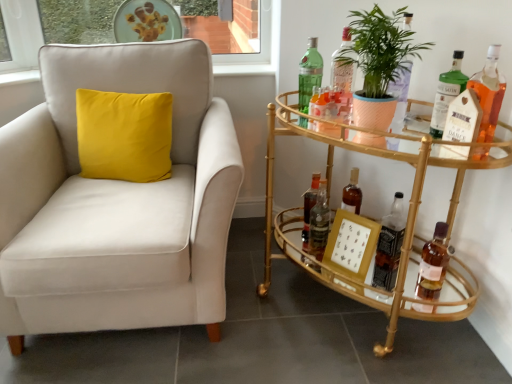
Question: Is the depth of green glass bottle at upper right, which appears as the 5th bottle when viewed from the right, greater than that of translucent glass bottle at right, which appears as the eighth bottle when viewed from the left?

Choices:
 (A) no
 (B) yes

Answer: (B)

Question: Is green glass bottle at upper right, which appears as the 5th bottle when viewed from the right, shorter than translucent glass bottle at right, which appears as the eighth bottle when viewed from the left?

Choices:
 (A) no
 (B) yes

Answer: (A)

Question: Could you tell me if green glass bottle at upper right, which appears as the 5th bottle when viewed from the right, is turned towards translucent glass bottle at right, which appears as the eighth bottle when viewed from the left?

Choices:
 (A) no
 (B) yes

Answer: (A)

Question: Does green glass bottle at upper right, which appears as the 5th bottle when viewed from the right, have a greater width compared to translucent glass bottle at right, placed as the 1th bottle when sorted from right to left?

Choices:
 (A) yes
 (B) no

Answer: (A)

Question: Does green glass bottle at upper right, which is the 4th bottle in left-to-right order, have a larger size compared to translucent glass bottle at right, placed as the 1th bottle when sorted from right to left?

Choices:
 (A) yes
 (B) no

Answer: (A)

Question: Considering the relative sizes of green glass bottle at upper right, which is the 4th bottle in left-to-right order, and translucent glass bottle at right, placed as the 1th bottle when sorted from right to left, in the image provided, is green glass bottle at upper right, which is the 4th bottle in left-to-right order, taller than translucent glass bottle at right, placed as the 1th bottle when sorted from right to left,?

Choices:
 (A) no
 (B) yes

Answer: (B)

Question: Could you tell me if gold glass bar cart at right is facing translucent glass bottle at right, placed as the 1th bottle when sorted from right to left?

Choices:
 (A) no
 (B) yes

Answer: (A)

Question: From a real-world perspective, is gold glass bar cart at right under translucent glass bottle at right, which appears as the eighth bottle when viewed from the left?

Choices:
 (A) no
 (B) yes

Answer: (B)

Question: Considering the relative positions of gold glass bar cart at right and translucent glass bottle at right, placed as the 1th bottle when sorted from right to left, in the image provided, is gold glass bar cart at right in front of translucent glass bottle at right, placed as the 1th bottle when sorted from right to left,?

Choices:
 (A) yes
 (B) no

Answer: (A)

Question: Considering the relative sizes of gold glass bar cart at right and translucent glass bottle at right, placed as the 1th bottle when sorted from right to left, in the image provided, is gold glass bar cart at right wider than translucent glass bottle at right, placed as the 1th bottle when sorted from right to left,?

Choices:
 (A) yes
 (B) no

Answer: (A)

Question: From a real-world perspective, is gold glass bar cart at right on top of translucent glass bottle at right, placed as the 1th bottle when sorted from right to left?

Choices:
 (A) no
 (B) yes

Answer: (A)

Question: Is gold glass bar cart at right facing away from translucent glass bottle at right, which appears as the eighth bottle when viewed from the left?

Choices:
 (A) no
 (B) yes

Answer: (A)

Question: Would you say translucent glass bottle at center, the fifth bottle when ordered from left to right, is part of green matte plant at right's contents?

Choices:
 (A) no
 (B) yes

Answer: (A)